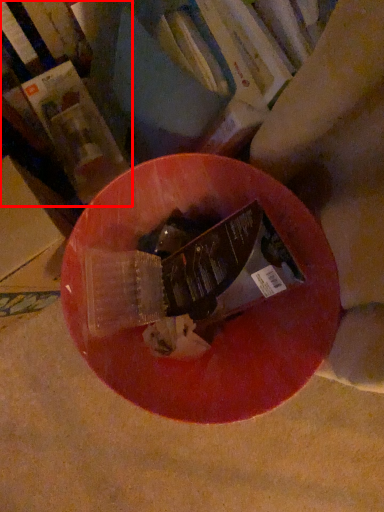
Question: From the image, what is the correct spatial relationship of book (annotated by the red box) in relation to book?

Choices:
 (A) right
 (B) left

Answer: (B)